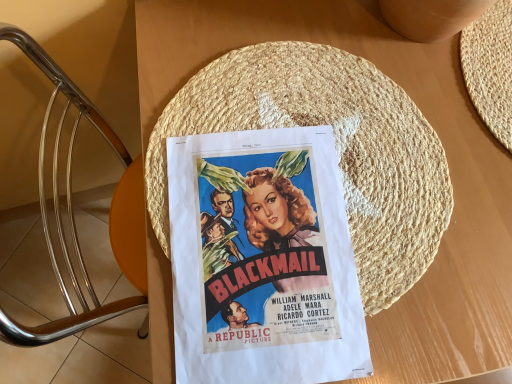
Find the location of a particular element. matte paper poster at center is located at coordinates (263, 260).

This screenshot has width=512, height=384. What do you see at coordinates (263, 260) in the screenshot? I see `matte paper poster at center` at bounding box center [263, 260].

Measure the distance between natural straw hat at center and camera.

18.70 inches.

What is the approximate width of natural straw hat at center?

The width of natural straw hat at center is 14.99 inches.

Describe the element at coordinates (336, 148) in the screenshot. I see `natural straw hat at center` at that location.

Identify the location of natural straw hat at center. (336, 148).

Find the location of `matte paper poster at center`. matte paper poster at center is located at coordinates (263, 260).

In the scene shown: Can you confirm if natural straw hat at center is positioned to the left of matte paper poster at center?

No.

Relative to matte paper poster at center, is natural straw hat at center in front or behind?

Clearly, natural straw hat at center is behind matte paper poster at center.

Does point (368, 235) appear closer or farther from the camera than point (220, 197)?

Clearly, point (368, 235) is more distant from the camera than point (220, 197).

From the image's perspective, which is below, natural straw hat at center or matte paper poster at center?

From the image's view, matte paper poster at center is below.

From a real-world perspective, is natural straw hat at center above or below matte paper poster at center?

natural straw hat at center is situated lower than matte paper poster at center in the real world.

Considering the sizes of objects natural straw hat at center and matte paper poster at center in the image provided, who is wider, natural straw hat at center or matte paper poster at center?

Wider between the two is natural straw hat at center.

Between natural straw hat at center and matte paper poster at center, which one has less height?

matte paper poster at center is shorter.

Consider the image. Looking at the image, does natural straw hat at center seem bigger or smaller compared to matte paper poster at center?

natural straw hat at center is bigger than matte paper poster at center.

Is matte paper poster at center located within natural straw hat at center?

That's correct, matte paper poster at center is inside natural straw hat at center.

Is natural straw hat at center in contact with matte paper poster at center?

Yes.

Is natural straw hat at center aimed at matte paper poster at center?

Yes, natural straw hat at center is oriented towards matte paper poster at center.

This screenshot has height=384, width=512. Find the location of `straw hat below the matte paper poster at center (from a real-world perspective)`. straw hat below the matte paper poster at center (from a real-world perspective) is located at coordinates (336, 148).

Considering the positions of objects matte paper poster at center and natural straw hat at center in the image provided, who is more to the left, matte paper poster at center or natural straw hat at center?

matte paper poster at center.

Is matte paper poster at center closer to camera compared to natural straw hat at center?

Yes, it is in front of natural straw hat at center.

Does point (284, 204) come in front of point (296, 47)?

Yes, it is.

From the image's perspective, which object appears higher, matte paper poster at center or natural straw hat at center?

natural straw hat at center appears higher in the image.

From a real-world perspective, which is physically below, matte paper poster at center or natural straw hat at center?

natural straw hat at center, from a real-world perspective.

Looking at their sizes, would you say matte paper poster at center is wider or thinner than natural straw hat at center?

In the image, matte paper poster at center appears to be more narrow than natural straw hat at center.

Does matte paper poster at center have a greater height compared to natural straw hat at center?

No.

Looking at this image, considering the sizes of objects matte paper poster at center and natural straw hat at center in the image provided, who is smaller, matte paper poster at center or natural straw hat at center?

Smaller between the two is matte paper poster at center.

Would you say matte paper poster at center is outside natural straw hat at center?

No.

Is matte paper poster at center placed right next to natural straw hat at center?

Indeed, matte paper poster at center and natural straw hat at center are beside each other and touching.

Is matte paper poster at center oriented towards natural straw hat at center?

Yes, matte paper poster at center is oriented towards natural straw hat at center.

Where is `poster in front of the natural straw hat at center`? The height and width of the screenshot is (384, 512). poster in front of the natural straw hat at center is located at coordinates (263, 260).

This screenshot has width=512, height=384. I want to click on poster that appears below the natural straw hat at center (from the image's perspective), so click(x=263, y=260).

Identify the location of straw hat that is behind the matte paper poster at center. (336, 148).